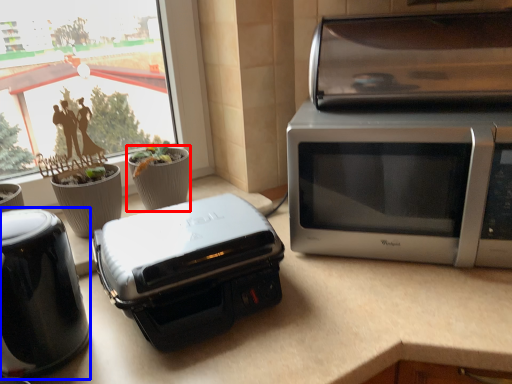
Question: Which object appears closest to the camera in this image, flowerpot (highlighted by a red box) or home appliance (highlighted by a blue box)?

Choices:
 (A) flowerpot
 (B) home appliance

Answer: (B)